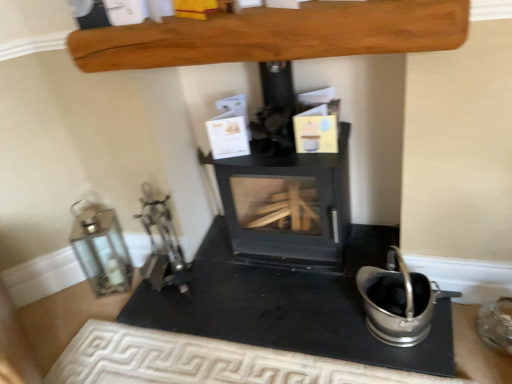
Measure the distance between black matte wood burning stove at center and camera.

1.54 meters.

The width and height of the screenshot is (512, 384). Describe the element at coordinates (101, 250) in the screenshot. I see `silver metallic lantern at left, acting as the 1th appliance starting from the left` at that location.

Measure the distance between point (236, 50) and camera.

A distance of 1.24 meters exists between point (236, 50) and camera.

You are a GUI agent. You are given a task and a screenshot of the screen. Output one action in this format:
    pyautogui.click(x=<x>, y=<y>)
    Task: Click on the black matte wood burning stove at center
    Image resolution: width=512 pixels, height=384 pixels.
    Given the screenshot: What is the action you would take?
    pyautogui.click(x=287, y=207)

Looking at this image, measure the distance between black matte wood burning stove at center and silver metallic lantern at left, acting as the 1th appliance starting from the left.

A distance of 74.79 centimeters exists between black matte wood burning stove at center and silver metallic lantern at left, acting as the 1th appliance starting from the left.

Does black matte wood burning stove at center have a greater height compared to silver metallic lantern at left, acting as the 1th appliance starting from the left?

Yes.

Is the depth of black matte wood burning stove at center greater than that of silver metallic lantern at left, acting as the 1th appliance starting from the left?

No, the depth of black matte wood burning stove at center is less than that of silver metallic lantern at left, acting as the 1th appliance starting from the left.

Is black matte wood burning stove at center not within silver metallic lantern at left, the 3th appliance positioned from the right?

Yes.

From the image's perspective, which object appears higher, transparent glass jar at lower right, the 1th appliance in the right-to-left sequence, or silver metallic lantern at left, acting as the 1th appliance starting from the left?

silver metallic lantern at left, acting as the 1th appliance starting from the left.

Is transparent glass jar at lower right, positioned as the third appliance in left-to-right order, thinner than silver metallic lantern at left, the 3th appliance positioned from the right?

Yes.

Considering the relative sizes of transparent glass jar at lower right, the 1th appliance in the right-to-left sequence, and silver metallic lantern at left, the 3th appliance positioned from the right, in the image provided, is transparent glass jar at lower right, the 1th appliance in the right-to-left sequence, taller than silver metallic lantern at left, the 3th appliance positioned from the right,?

No, transparent glass jar at lower right, the 1th appliance in the right-to-left sequence, is not taller than silver metallic lantern at left, the 3th appliance positioned from the right.

How many degrees apart are the facing directions of transparent glass jar at lower right, positioned as the third appliance in left-to-right order, and silver metallic lantern at left, acting as the 1th appliance starting from the left?

The angle between the facing direction of transparent glass jar at lower right, positioned as the third appliance in left-to-right order, and the facing direction of silver metallic lantern at left, acting as the 1th appliance starting from the left, is 43.4 degrees.

Does point (388, 255) appear closer or farther from the camera than point (211, 48)?

Point (388, 255).

From the image's perspective, is satin silver bucket at lower right, acting as the second appliance starting from the right, above or below smooth wooden beam at upper center?

From the image's perspective, satin silver bucket at lower right, acting as the second appliance starting from the right, appears below smooth wooden beam at upper center.

Between satin silver bucket at lower right, acting as the second appliance starting from the right, and smooth wooden beam at upper center, which one appears on the left side from the viewer's perspective?

From the viewer's perspective, smooth wooden beam at upper center appears more on the left side.

How different are the orientations of satin silver bucket at lower right, acting as the 2th appliance starting from the left, and smooth wooden beam at upper center in degrees?

They differ by 1.95 degrees in their facing directions.

Does satin silver bucket at lower right, acting as the second appliance starting from the right, appear on the right side of transparent glass jar at lower right, positioned as the third appliance in left-to-right order?

No, satin silver bucket at lower right, acting as the second appliance starting from the right, is not to the right of transparent glass jar at lower right, positioned as the third appliance in left-to-right order.

Can you confirm if satin silver bucket at lower right, acting as the 2th appliance starting from the left, is thinner than transparent glass jar at lower right, the 1th appliance in the right-to-left sequence?

No.

Is satin silver bucket at lower right, acting as the 2th appliance starting from the left, taller than transparent glass jar at lower right, the 1th appliance in the right-to-left sequence?

Indeed, satin silver bucket at lower right, acting as the 2th appliance starting from the left, has a greater height compared to transparent glass jar at lower right, the 1th appliance in the right-to-left sequence.

Is satin silver bucket at lower right, acting as the second appliance starting from the right, with transparent glass jar at lower right, positioned as the third appliance in left-to-right order?

satin silver bucket at lower right, acting as the second appliance starting from the right, and transparent glass jar at lower right, positioned as the third appliance in left-to-right order, are not in contact.

Which is closer, [90,214] or [497,325]?

The point [497,325] is more forward.

Does silver metallic lantern at left, the 3th appliance positioned from the right, appear on the left side of transparent glass jar at lower right, positioned as the third appliance in left-to-right order?

Yes, silver metallic lantern at left, the 3th appliance positioned from the right, is to the left of transparent glass jar at lower right, positioned as the third appliance in left-to-right order.

Considering the relative sizes of silver metallic lantern at left, acting as the 1th appliance starting from the left, and transparent glass jar at lower right, positioned as the third appliance in left-to-right order, in the image provided, is silver metallic lantern at left, acting as the 1th appliance starting from the left, smaller than transparent glass jar at lower right, positioned as the third appliance in left-to-right order,?

Incorrect, silver metallic lantern at left, acting as the 1th appliance starting from the left, is not smaller in size than transparent glass jar at lower right, positioned as the third appliance in left-to-right order.

Can transparent glass jar at lower right, the 1th appliance in the right-to-left sequence, be found inside silver metallic lantern at left, acting as the 1th appliance starting from the left?

No, transparent glass jar at lower right, the 1th appliance in the right-to-left sequence, is not surrounded by silver metallic lantern at left, acting as the 1th appliance starting from the left.

Which object is closer to the camera, satin silver bucket at lower right, acting as the 2th appliance starting from the left, or black matte wood burning stove at center?

satin silver bucket at lower right, acting as the 2th appliance starting from the left, is in front.

Is satin silver bucket at lower right, acting as the 2th appliance starting from the left, inside or outside of black matte wood burning stove at center?

satin silver bucket at lower right, acting as the 2th appliance starting from the left, is not inside black matte wood burning stove at center, it's outside.

Who is taller, satin silver bucket at lower right, acting as the 2th appliance starting from the left, or black matte wood burning stove at center?

black matte wood burning stove at center.

From the image's perspective, is satin silver bucket at lower right, acting as the 2th appliance starting from the left, located above black matte wood burning stove at center?

No, from the image's perspective, satin silver bucket at lower right, acting as the 2th appliance starting from the left, is not over black matte wood burning stove at center.

What's the angular difference between transparent glass jar at lower right, the 1th appliance in the right-to-left sequence, and black matte wood burning stove at center's facing directions?

1 degrees.

From the picture: Is transparent glass jar at lower right, positioned as the third appliance in left-to-right order, with black matte wood burning stove at center?

transparent glass jar at lower right, positioned as the third appliance in left-to-right order, and black matte wood burning stove at center are clearly separated.

Could you tell me if transparent glass jar at lower right, positioned as the third appliance in left-to-right order, is turned towards black matte wood burning stove at center?

No, transparent glass jar at lower right, positioned as the third appliance in left-to-right order, is not aimed at black matte wood burning stove at center.

I want to click on appliance that is the 1st one below the black matte wood burning stove at center (from a real-world perspective), so click(x=101, y=250).

You are a GUI agent. You are given a task and a screenshot of the screen. Output one action in this format:
    pyautogui.click(x=<x>, y=<y>)
    Task: Click on the 2nd appliance to the right of the silver metallic lantern at left, acting as the 1th appliance starting from the left, starting your count from the anchor
    
    Given the screenshot: What is the action you would take?
    pyautogui.click(x=496, y=324)

Based on their spatial positions, is silver metallic lantern at left, the 3th appliance positioned from the right, or satin silver bucket at lower right, acting as the second appliance starting from the right, further from smooth wooden beam at upper center?

Among the two, silver metallic lantern at left, the 3th appliance positioned from the right, is located further to smooth wooden beam at upper center.

When comparing their distances from black matte wood burning stove at center, does smooth wooden beam at upper center or satin silver bucket at lower right, acting as the 2th appliance starting from the left, seem further?

smooth wooden beam at upper center is positioned further to the anchor black matte wood burning stove at center.

Which object lies further to the anchor point transparent glass jar at lower right, the 1th appliance in the right-to-left sequence, smooth wooden beam at upper center or silver metallic lantern at left, acting as the 1th appliance starting from the left?

silver metallic lantern at left, acting as the 1th appliance starting from the left, lies further to transparent glass jar at lower right, the 1th appliance in the right-to-left sequence, than the other object.

From the picture: From the image, which object appears to be farther from smooth wooden beam at upper center, black matte wood burning stove at center or satin silver bucket at lower right, acting as the second appliance starting from the right?

satin silver bucket at lower right, acting as the second appliance starting from the right.

Looking at the image, which one is located further to black matte wood burning stove at center, satin silver bucket at lower right, acting as the second appliance starting from the right, or transparent glass jar at lower right, positioned as the third appliance in left-to-right order?

transparent glass jar at lower right, positioned as the third appliance in left-to-right order, lies further to black matte wood burning stove at center than the other object.

Based on the photo, estimate the real-world distances between objects in this image. Which object is closer to smooth wooden beam at upper center, transparent glass jar at lower right, positioned as the third appliance in left-to-right order, or satin silver bucket at lower right, acting as the 2th appliance starting from the left?

The object closer to smooth wooden beam at upper center is satin silver bucket at lower right, acting as the 2th appliance starting from the left.

From the image, which object appears to be nearer to silver metallic lantern at left, the 3th appliance positioned from the right, black matte wood burning stove at center or transparent glass jar at lower right, positioned as the third appliance in left-to-right order?

The object closer to silver metallic lantern at left, the 3th appliance positioned from the right, is black matte wood burning stove at center.

Looking at the image, which one is located further to black matte wood burning stove at center, transparent glass jar at lower right, the 1th appliance in the right-to-left sequence, or silver metallic lantern at left, the 3th appliance positioned from the right?

transparent glass jar at lower right, the 1th appliance in the right-to-left sequence.

This screenshot has height=384, width=512. I want to click on furniture located between silver metallic lantern at left, acting as the 1th appliance starting from the left, and transparent glass jar at lower right, the 1th appliance in the right-to-left sequence, in the left-right direction, so (276, 35).

Locate an element on the screen. This screenshot has width=512, height=384. appliance between black matte wood burning stove at center and transparent glass jar at lower right, positioned as the third appliance in left-to-right order, from left to right is located at coordinates (398, 301).

The width and height of the screenshot is (512, 384). In order to click on wood burning stove between smooth wooden beam at upper center and satin silver bucket at lower right, acting as the second appliance starting from the right, vertically in this screenshot , I will do `click(287, 207)`.

Find the location of `furniture located between silver metallic lantern at left, the 3th appliance positioned from the right, and black matte wood burning stove at center in the left-right direction`. furniture located between silver metallic lantern at left, the 3th appliance positioned from the right, and black matte wood burning stove at center in the left-right direction is located at coordinates (276, 35).